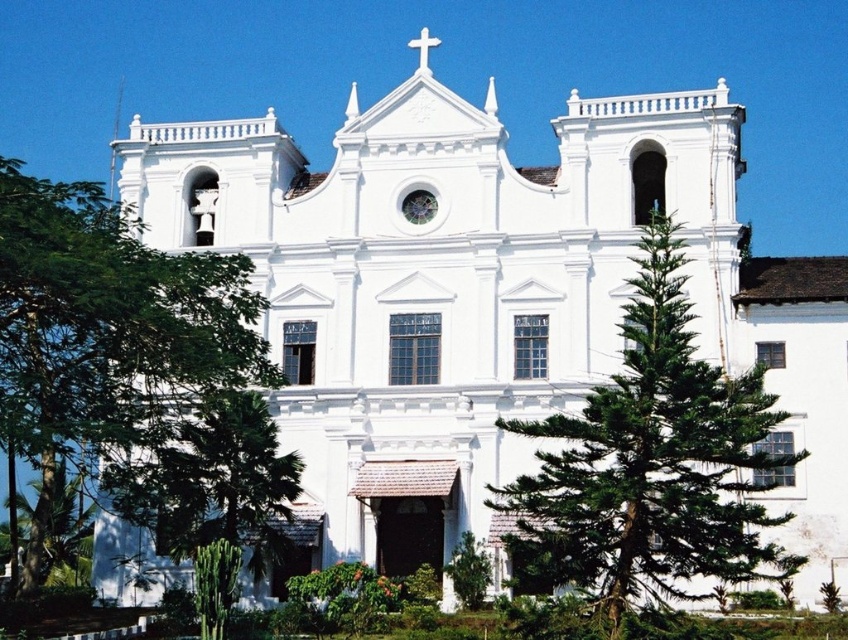
Question: Which of the following is the farthest from the observer?

Choices:
 (A) (10, 323)
 (B) (130, 492)

Answer: (B)

Question: Which of the following is the farthest from the observer?

Choices:
 (A) (645, 236)
 (B) (210, 518)

Answer: (B)

Question: Is green leafy tree at right smaller than green leafy tree at lower left?

Choices:
 (A) yes
 (B) no

Answer: (B)

Question: Which of the following is the closest to the observer?

Choices:
 (A) green leafy tree at left
 (B) green leafy tree at right

Answer: (B)

Question: Does green leafy tree at left appear under green leafy tree at right?

Choices:
 (A) yes
 (B) no

Answer: (B)

Question: In this image, where is green leafy tree at right located relative to green leafy tree at lower left?

Choices:
 (A) above
 (B) below

Answer: (A)